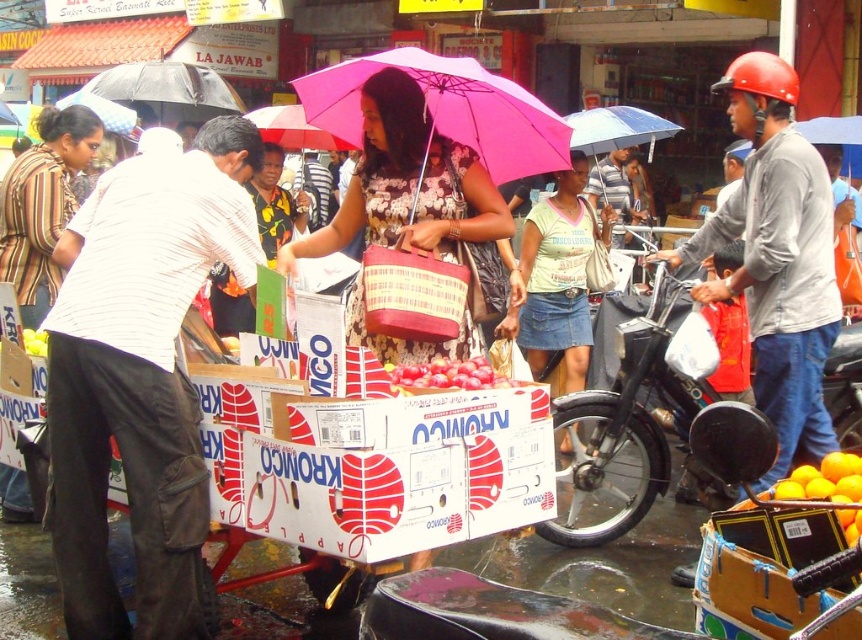
Who is lower down, striped fabric shirt at left or orange matte at lower right?

Positioned lower is orange matte at lower right.

Where is `striped fabric shirt at left`? The image size is (862, 640). striped fabric shirt at left is located at coordinates (42, 205).

Is matte gray shirt at center wider than matte black umbrella at upper center?

Yes, matte gray shirt at center is wider than matte black umbrella at upper center.

Can you confirm if matte gray shirt at center is bigger than matte black umbrella at upper center?

Indeed, matte gray shirt at center has a larger size compared to matte black umbrella at upper center.

Image resolution: width=862 pixels, height=640 pixels. Describe the element at coordinates (776, 257) in the screenshot. I see `matte gray shirt at center` at that location.

This screenshot has height=640, width=862. Identify the location of matte gray shirt at center. (776, 257).

Consider the image. How much distance is there between white striped shirt at left and striped fabric shirt at left?

A distance of 5.65 feet exists between white striped shirt at left and striped fabric shirt at left.

Which of these two, white striped shirt at left or striped fabric shirt at left, stands taller?

white striped shirt at left

Between point (180, 380) and point (53, 205), which one is positioned in front?

Point (180, 380) is more forward.

At what (x,y) coordinates should I click in order to perform the action: click on white striped shirt at left. Please return your answer as a coordinate pair (x, y). The image size is (862, 640). Looking at the image, I should click on (141, 378).